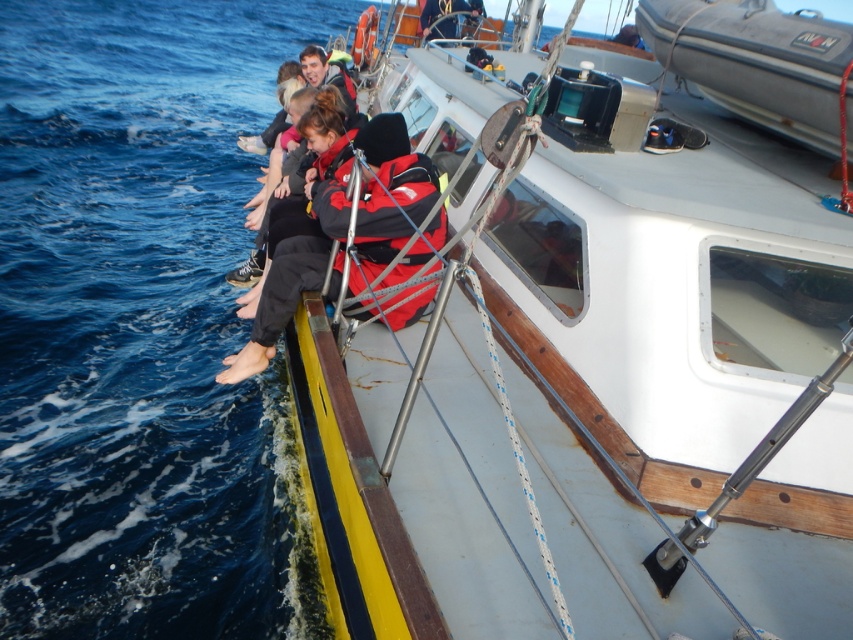
The height and width of the screenshot is (640, 853). What are the coordinates of `blue water at lower left` in the screenshot? It's located at (138, 323).

Where is `blue water at lower left`? This screenshot has height=640, width=853. blue water at lower left is located at coordinates (138, 323).

Describe the element at coordinates (654, 330) in the screenshot. I see `white plastic boat at center` at that location.

Who is taller, white plastic boat at center or red jacket at left?

white plastic boat at center is taller.

Who is more distant from viewer, (543, 426) or (370, 198)?

Positioned behind is point (370, 198).

Locate an element on the screen. This screenshot has width=853, height=640. white plastic boat at center is located at coordinates coord(654,330).

Can you confirm if blue water at lower left is wider than red jacket at left?

Correct, the width of blue water at lower left exceeds that of red jacket at left.

Can you confirm if blue water at lower left is positioned to the right of red jacket at left?

In fact, blue water at lower left is to the left of red jacket at left.

Is point (207, 38) less distant than point (370, 262)?

No, (207, 38) is further to viewer.

You are a GUI agent. You are given a task and a screenshot of the screen. Output one action in this format:
    pyautogui.click(x=<x>, y=<y>)
    Task: Click on the blue water at lower left
    The image size is (853, 640).
    Given the screenshot: What is the action you would take?
    pyautogui.click(x=138, y=323)